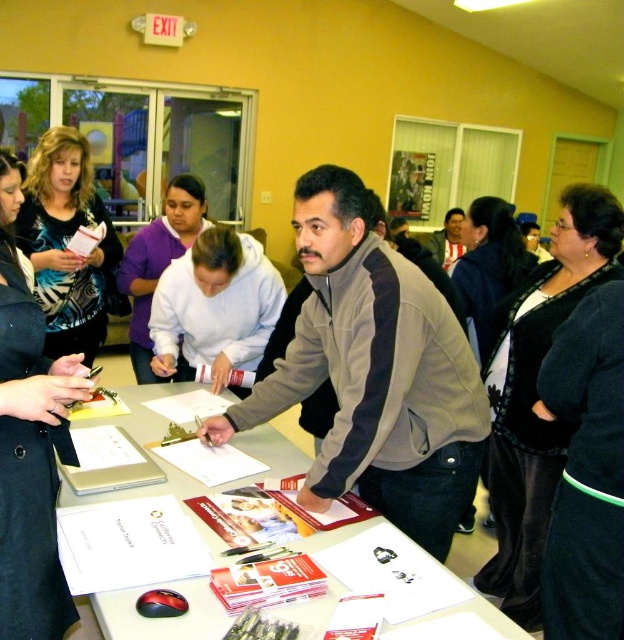
Is black textured sweater at center positioned in front of black textured dress at center?

Yes.

In the scene shown: Who is positioned more to the right, black textured sweater at center or black textured dress at center?

Positioned to the right is black textured sweater at center.

Which is in front, point (550, 472) or point (484, 241)?

Positioned in front is point (550, 472).

The width and height of the screenshot is (624, 640). What are the coordinates of `black textured sweater at center` in the screenshot? It's located at (537, 394).

Between point (470, 476) and point (562, 234), which one is positioned in front?

Point (470, 476) is more forward.

You are a GUI agent. You are given a task and a screenshot of the screen. Output one action in this format:
    pyautogui.click(x=<x>, y=<y>)
    Task: Click on the gray fleece jacket at center
    This screenshot has height=640, width=624.
    Given the screenshot: What is the action you would take?
    click(373, 372)

The image size is (624, 640). I want to click on gray fleece jacket at center, so tap(373, 372).

What do you see at coordinates (29, 444) in the screenshot? I see `matte black jacket at upper left` at bounding box center [29, 444].

Who is more forward, (37, 630) or (207, 291)?

Positioned in front is point (37, 630).

Who is more forward, (0, 339) or (256, 352)?

Point (0, 339) is more forward.

Identify the location of matte black jacket at upper left. (29, 444).